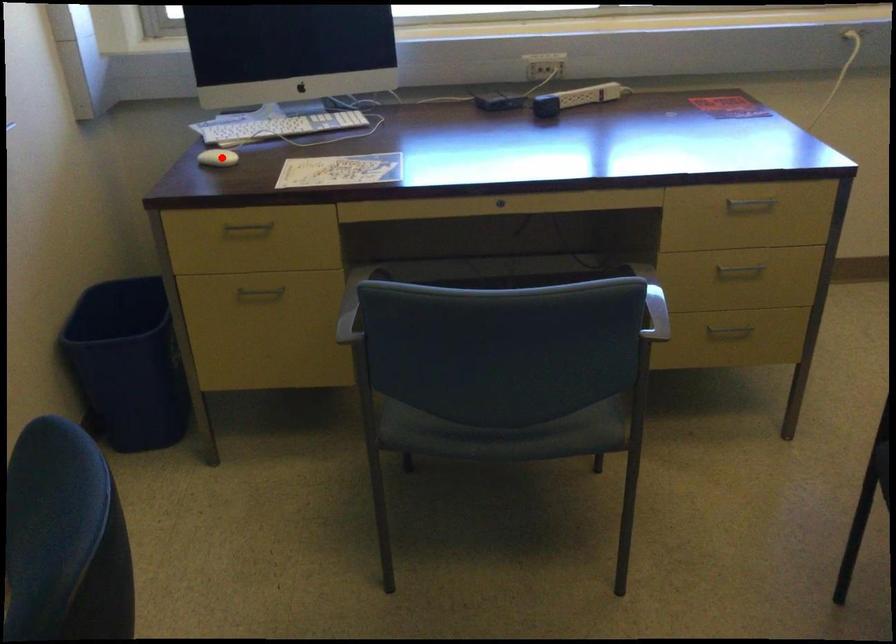
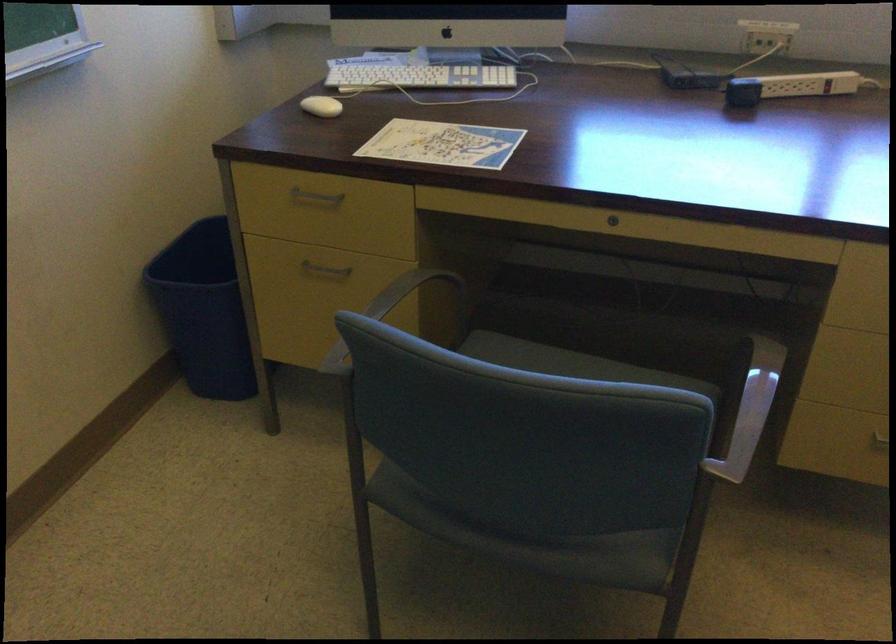
Question: I am providing you with two images of the same scene from different viewpoints. Given a red point in image1, look at the same physical point in image2. Is it:

Choices:
 (A) Closer to the viewpoint
 (B) Farther from the viewpoint

Answer: (A)